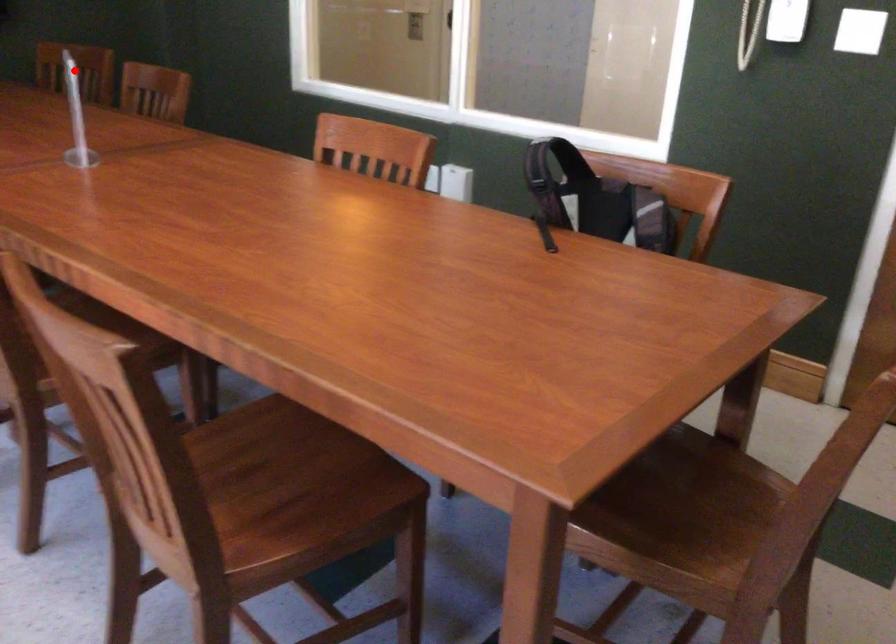
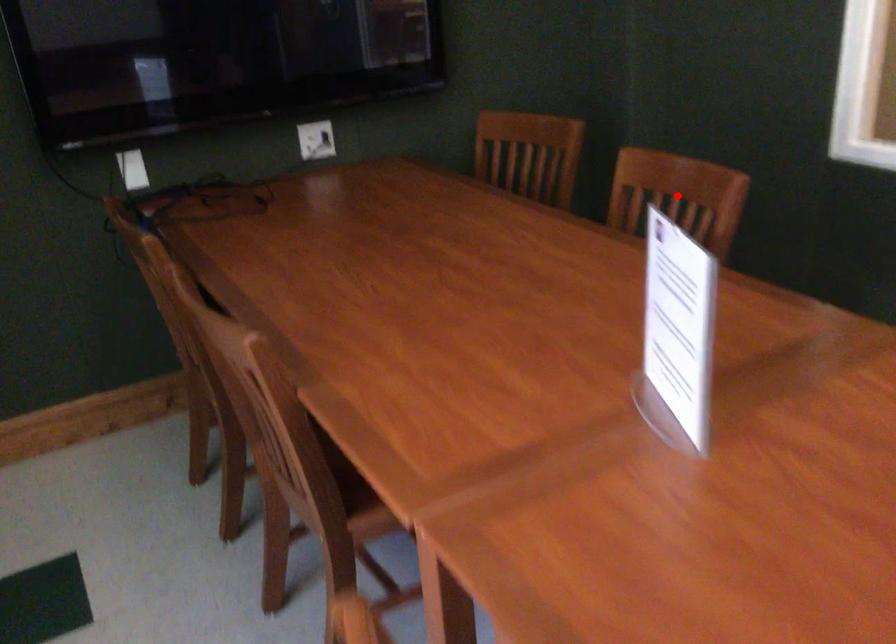
I am providing you with two images of the same scene from different viewpoints. A red point is marked on the first image and another point is marked on the second image. Is the red point in image1 aligned with the point shown in image2?

No